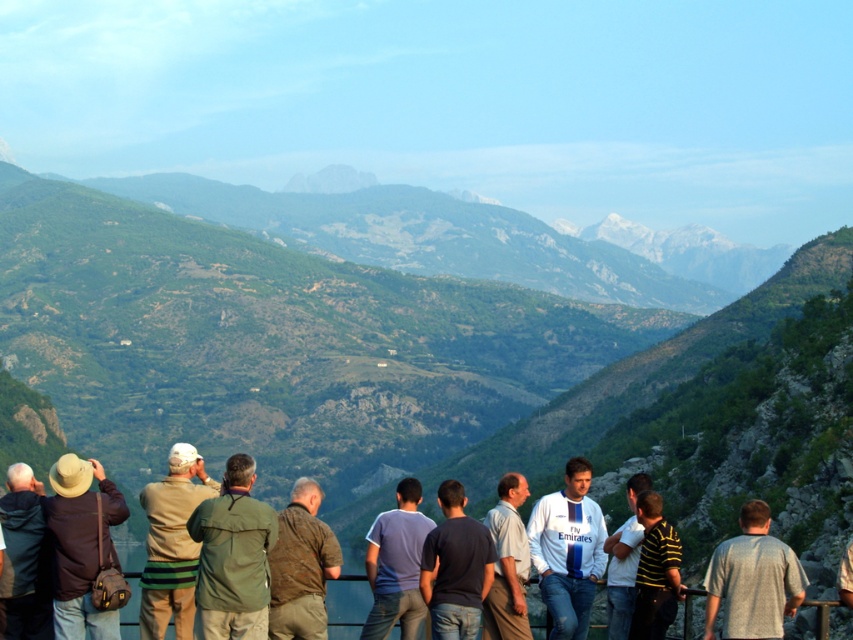
Question: Considering the relative positions of gray cotton shirt at center and brown textured jacket at center in the image provided, where is gray cotton shirt at center located with respect to brown textured jacket at center?

Choices:
 (A) left
 (B) right

Answer: (B)

Question: Which point is closer to the camera taking this photo?

Choices:
 (A) (184, 637)
 (B) (520, 595)
 (C) (395, 600)

Answer: (A)

Question: Which point is farther to the camera?

Choices:
 (A) (39, 636)
 (B) (418, 515)

Answer: (B)

Question: In this image, where is matte brown hat at left located relative to brown textured jacket at center?

Choices:
 (A) below
 (B) above

Answer: (B)

Question: From the image, what is the correct spatial relationship of brown textured jacket at center in relation to blue cotton shirt at center?

Choices:
 (A) below
 (B) above

Answer: (B)

Question: Which point is closer to the camera?

Choices:
 (A) (518, 515)
 (B) (384, 547)
 (C) (45, 624)
 (D) (647, 541)

Answer: (C)